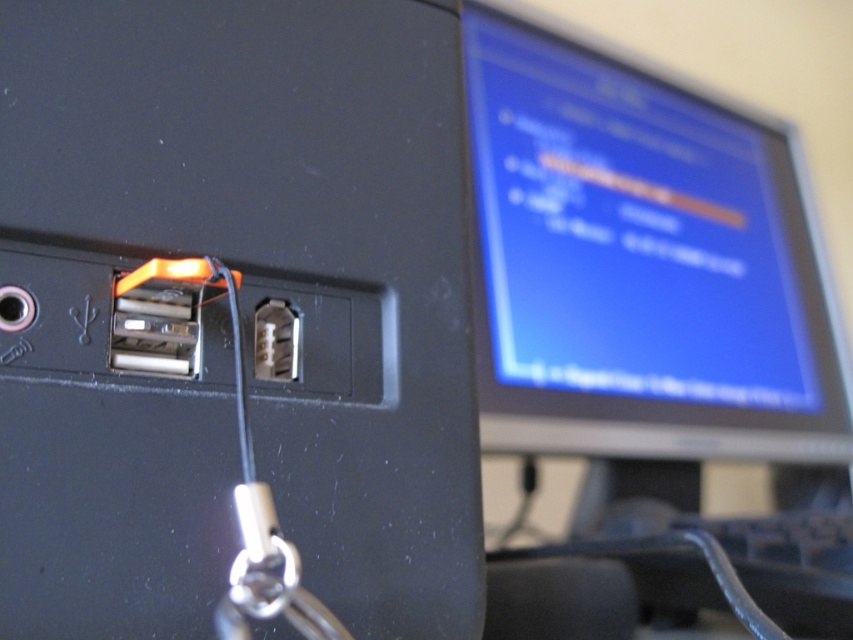
You have a USB cable that is 3.5 inches long. You need to connect it to both the matte black usb port at center and the metallic silver socket at center. Can the cable reach both connections if they are 3.58 inches apart?

The matte black usb port at center and metallic silver socket at center are 3.58 inches apart. Since the cable is only 3.5 inches long, it is 0.08 inches too short to reach both connections.

You are trying to connect a USB cable to your laptop. You notice the black plastic keyboard at lower right and the metallic silver socket at center. Which object is closer to the right edge of the laptop?

The black plastic keyboard at lower right is positioned on the right side of the metallic silver socket at center, so it is closer to the right edge of the laptop.